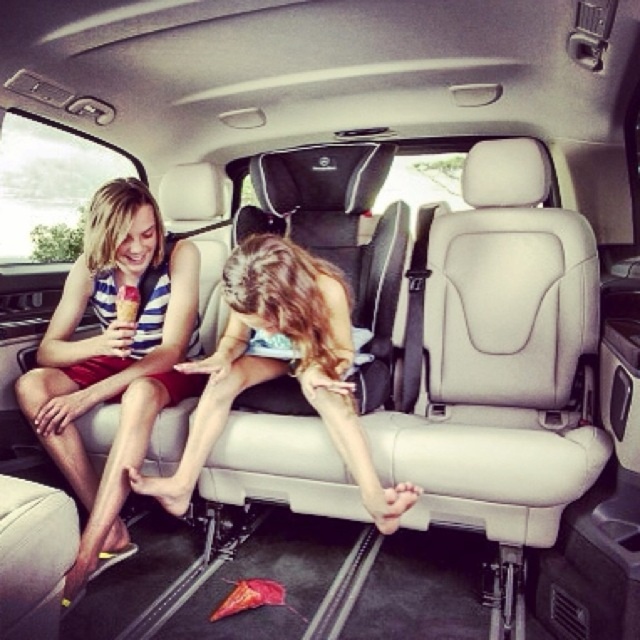
From the picture: Who is more forward, (189, 248) or (349, 429)?

Point (349, 429) is more forward.

Is matte striped tank top at left to the left of matte skin girl at center from the viewer's perspective?

Indeed, matte striped tank top at left is positioned on the left side of matte skin girl at center.

Where is `matte striped tank top at left`? The image size is (640, 640). matte striped tank top at left is located at coordinates (115, 358).